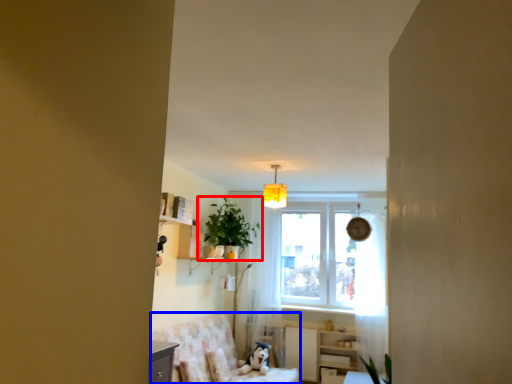
Question: Which object appears farthest to the camera in this image, houseplant (highlighted by a red box) or swivel chair (highlighted by a blue box)?

Choices:
 (A) houseplant
 (B) swivel chair

Answer: (A)